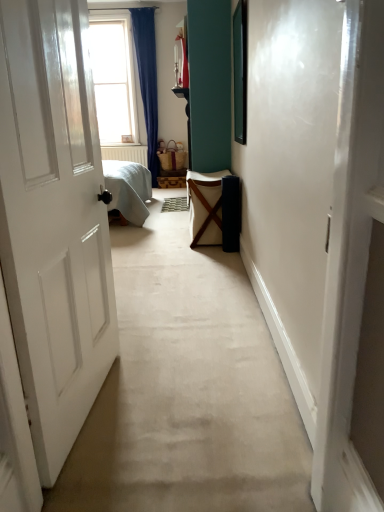
Question: Is clear glass window at upper left situated inside textured beige doormat at center or outside?

Choices:
 (A) inside
 (B) outside

Answer: (B)

Question: From a real-world perspective, is clear glass window at upper left positioned above or below textured beige doormat at center?

Choices:
 (A) below
 (B) above

Answer: (B)

Question: Estimate the real-world distances between objects in this image. Which object is farther from the clear glass window at upper left?

Choices:
 (A) textured beige doormat at center
 (B) white canvas laundry basket at center

Answer: (B)

Question: Which is nearer to the clear glass window at upper left?

Choices:
 (A) white canvas laundry basket at center
 (B) textured beige doormat at center

Answer: (B)